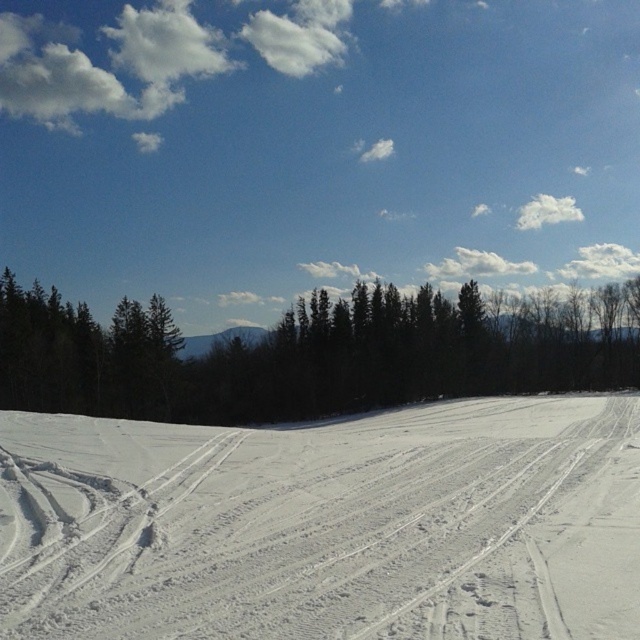
You are planning a snowmobile route and need to know the size of the white powdery snow at center compared to the green matte trees at center. Which one has a larger area in the image?

The green matte trees at center have a larger area than the white powdery snow at center in the image.

You are planning a cross country ski trip and need to know the width of the area between the white powdery snow at center and the green matte trees at center. Can you determine if the snow area is narrower than the tree line?

The white powdery snow at center has a width less than green matte trees at center, so yes, the snow area is narrower than the tree line.

You are standing at the point with coordinates point (284, 348) and want to walk towards the point with coordinates point (470, 627). Will the dense line of dark green evergreen trees in the midground block your path?

Point (470, 627) is in front of point (284, 348), so the dense line of dark green evergreen trees in the midground will block your path.